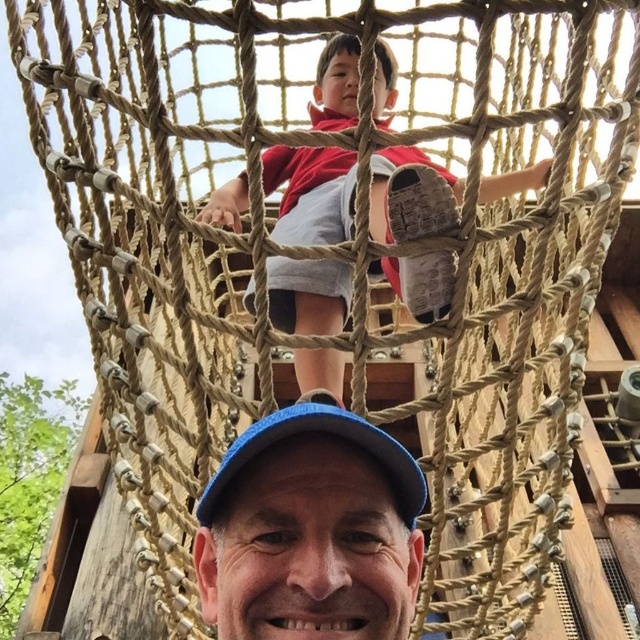
Question: Is matte red shirt at upper center to the right of blue fabric baseball cap at center from the viewer's perspective?

Choices:
 (A) yes
 (B) no

Answer: (B)

Question: Can you confirm if matte red shirt at upper center is bigger than blue fabric baseball cap at center?

Choices:
 (A) no
 (B) yes

Answer: (A)

Question: Among these points, which one is farthest from the camera?

Choices:
 (A) (259, 426)
 (B) (298, 355)

Answer: (B)

Question: Considering the relative positions of matte red shirt at upper center and blue fabric baseball cap at center in the image provided, where is matte red shirt at upper center located with respect to blue fabric baseball cap at center?

Choices:
 (A) left
 (B) right

Answer: (A)

Question: Which point is farther from the camera taking this photo?

Choices:
 (A) (392, 456)
 (B) (337, 372)

Answer: (B)